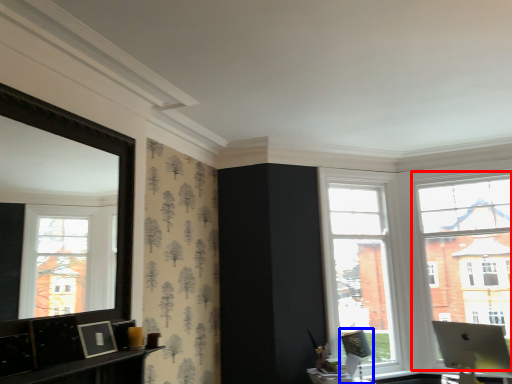
Question: Which object is closer to the camera taking this photo, window (highlighted by a red box) or swivel chair (highlighted by a blue box)?

Choices:
 (A) window
 (B) swivel chair

Answer: (B)